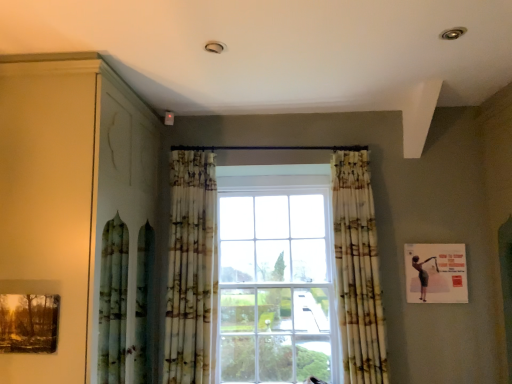
In order to face matte wood dresser at left, should I rotate leftwards or rightwards?

It's best to rotate left around 22.040 degrees.

You are a GUI agent. You are given a task and a screenshot of the screen. Output one action in this format:
    pyautogui.click(x=<x>, y=<y>)
    Task: Click on the printed fabric curtain at center, acting as the 1th curtain starting from the right
    
    Given the screenshot: What is the action you would take?
    pyautogui.click(x=357, y=270)

Identify the location of printed fabric curtain at center, which is the 1th curtain from left to right. (191, 268).

I want to click on matte wood dresser at left, so click(69, 195).

Is point (352, 339) closer to viewer compared to point (186, 186)?

Yes.

Considering the positions of objects printed fabric curtain at center, the second curtain when ordered from left to right, and printed fabric curtain at center, which is the 1th curtain from left to right, in the image provided, who is more to the left, printed fabric curtain at center, the second curtain when ordered from left to right, or printed fabric curtain at center, which is the 1th curtain from left to right,?

From the viewer's perspective, printed fabric curtain at center, which is the 1th curtain from left to right, appears more on the left side.

Is printed fabric curtain at center, the second curtain when ordered from left to right, further to camera compared to printed fabric curtain at center, the second curtain in the right-to-left sequence?

No, printed fabric curtain at center, the second curtain when ordered from left to right, is closer to the camera.

Can you confirm if matte wood dresser at left is shorter than printed fabric curtain at center, the second curtain when ordered from left to right?

No.

How different are the orientations of matte wood dresser at left and printed fabric curtain at center, acting as the 1th curtain starting from the right, in degrees?

The angle between the facing direction of matte wood dresser at left and the facing direction of printed fabric curtain at center, acting as the 1th curtain starting from the right, is 94.1 degrees.

Do you think matte wood dresser at left is within printed fabric curtain at center, the second curtain when ordered from left to right, or outside of it?

matte wood dresser at left is outside printed fabric curtain at center, the second curtain when ordered from left to right.

Considering the positions of point (54, 92) and point (375, 231), is point (54, 92) closer or farther from the camera than point (375, 231)?

Clearly, point (54, 92) is closer to the camera than point (375, 231).

Are matte wood dresser at left and matte wooden picture frame at lower left, placed as the 2th picture frame when sorted from back to front, located far from each other?

No, matte wood dresser at left is not far from matte wooden picture frame at lower left, placed as the 2th picture frame when sorted from back to front.

Is matte wood dresser at left outside of matte wooden picture frame at lower left, the second picture frame positioned from the right?

Yes.

Can you confirm if matte wood dresser at left is thinner than matte wooden picture frame at lower left, the 1th picture frame viewed from the left?

No, matte wood dresser at left is not thinner than matte wooden picture frame at lower left, the 1th picture frame viewed from the left.

How different are the orientations of matte wooden picture frame at lower left, the second picture frame positioned from the right, and printed fabric curtain at center, which is the 1th curtain from left to right, in degrees?

There is a 0.529-degree angle between the facing directions of matte wooden picture frame at lower left, the second picture frame positioned from the right, and printed fabric curtain at center, which is the 1th curtain from left to right.

Based on their sizes in the image, would you say matte wooden picture frame at lower left, which is the 1th picture frame from front to back, is bigger or smaller than printed fabric curtain at center, which is the 1th curtain from left to right?

matte wooden picture frame at lower left, which is the 1th picture frame from front to back, is smaller than printed fabric curtain at center, which is the 1th curtain from left to right.

Is matte wooden picture frame at lower left, which is the 1th picture frame from front to back, located outside printed fabric curtain at center, the second curtain in the right-to-left sequence?

matte wooden picture frame at lower left, which is the 1th picture frame from front to back, lies outside printed fabric curtain at center, the second curtain in the right-to-left sequence,'s area.

From the image's perspective, would you say matte wooden picture frame at lower left, the 1th picture frame viewed from the left, is shown under printed fabric curtain at center, the second curtain in the right-to-left sequence?

Yes.

Can we say printed fabric curtain at center, the second curtain in the right-to-left sequence, lies outside matte black picture frame at upper right, the second picture frame viewed from the left?

Absolutely, printed fabric curtain at center, the second curtain in the right-to-left sequence, is external to matte black picture frame at upper right, the second picture frame viewed from the left.

Can you tell me how much printed fabric curtain at center, which is the 1th curtain from left to right, and matte black picture frame at upper right, which is the 1th picture frame from right to left, differ in facing direction?

They differ by 0.932 degrees in their facing directions.

Relative to matte black picture frame at upper right, which is the 1th picture frame from right to left, is printed fabric curtain at center, which is the 1th curtain from left to right, in front or behind?

In the image, printed fabric curtain at center, which is the 1th curtain from left to right, appears in front of matte black picture frame at upper right, which is the 1th picture frame from right to left.

From the image's perspective, does printed fabric curtain at center, the second curtain in the right-to-left sequence, appear higher than matte black picture frame at upper right, marked as the 1th picture frame in a back-to-front arrangement?

Indeed, from the image's perspective, printed fabric curtain at center, the second curtain in the right-to-left sequence, is shown above matte black picture frame at upper right, marked as the 1th picture frame in a back-to-front arrangement.

Is matte black picture frame at upper right, which is the 1th picture frame from right to left, positioned in front of printed fabric curtain at center, the second curtain when ordered from left to right?

No, matte black picture frame at upper right, which is the 1th picture frame from right to left, is further to the viewer.

From the image's perspective, is matte black picture frame at upper right, the second picture frame viewed from the left, below printed fabric curtain at center, acting as the 1th curtain starting from the right?

Yes, from the image's perspective, matte black picture frame at upper right, the second picture frame viewed from the left, is below printed fabric curtain at center, acting as the 1th curtain starting from the right.

Considering the sizes of objects matte black picture frame at upper right, which is the 1th picture frame from right to left, and printed fabric curtain at center, acting as the 1th curtain starting from the right, in the image provided, who is thinner, matte black picture frame at upper right, which is the 1th picture frame from right to left, or printed fabric curtain at center, acting as the 1th curtain starting from the right,?

With smaller width is matte black picture frame at upper right, which is the 1th picture frame from right to left.

Does matte black picture frame at upper right, the second picture frame viewed from the left, have a smaller size compared to printed fabric curtain at center, acting as the 1th curtain starting from the right?

Indeed, matte black picture frame at upper right, the second picture frame viewed from the left, has a smaller size compared to printed fabric curtain at center, acting as the 1th curtain starting from the right.

In the image, is matte wood dresser at left on the left side or the right side of matte black picture frame at upper right, which is the 1th picture frame from right to left?

From the image, it's evident that matte wood dresser at left is to the left of matte black picture frame at upper right, which is the 1th picture frame from right to left.

Is point (77, 265) closer to viewer compared to point (446, 276)?

Yes, it is.

Which of these two, matte wood dresser at left or matte black picture frame at upper right, the second picture frame viewed from the left, stands shorter?

matte black picture frame at upper right, the second picture frame viewed from the left, is shorter.

The width and height of the screenshot is (512, 384). I want to click on dresser that is on the left side of matte black picture frame at upper right, placed as the 2th picture frame when sorted from front to back, so click(69, 195).

Where is `curtain above the printed fabric curtain at center, the second curtain when ordered from left to right (from the image's perspective)`? curtain above the printed fabric curtain at center, the second curtain when ordered from left to right (from the image's perspective) is located at coordinates (191, 268).

Identify the location of the 2nd curtain below the matte wood dresser at left (from the image's perspective). (357, 270).

Considering their positions, is matte black picture frame at upper right, the second picture frame viewed from the left, positioned closer to printed fabric curtain at center, which is the 1th curtain from left to right, than matte wooden picture frame at lower left, which is the 1th picture frame from front to back?

Among the two, matte wooden picture frame at lower left, which is the 1th picture frame from front to back, is located nearer to printed fabric curtain at center, which is the 1th curtain from left to right.

Considering their positions, is matte black picture frame at upper right, marked as the 1th picture frame in a back-to-front arrangement, positioned further to matte wood dresser at left than printed fabric curtain at center, which is the 1th curtain from left to right?

matte black picture frame at upper right, marked as the 1th picture frame in a back-to-front arrangement, is further to matte wood dresser at left.

Which object lies nearer to the anchor point matte wood dresser at left, matte black picture frame at upper right, marked as the 1th picture frame in a back-to-front arrangement, or printed fabric curtain at center, the second curtain when ordered from left to right?

Among the two, printed fabric curtain at center, the second curtain when ordered from left to right, is located nearer to matte wood dresser at left.

Which object lies nearer to the anchor point matte black picture frame at upper right, placed as the 2th picture frame when sorted from front to back, matte wooden picture frame at lower left, the second picture frame positioned from the right, or matte wood dresser at left?

matte wood dresser at left is closer to matte black picture frame at upper right, placed as the 2th picture frame when sorted from front to back.

Looking at the image, which one is located further to matte wood dresser at left, printed fabric curtain at center, the second curtain in the right-to-left sequence, or matte black picture frame at upper right, marked as the 1th picture frame in a back-to-front arrangement?

matte black picture frame at upper right, marked as the 1th picture frame in a back-to-front arrangement.

Looking at the image, which one is located further to matte black picture frame at upper right, marked as the 1th picture frame in a back-to-front arrangement, matte wood dresser at left or printed fabric curtain at center, which is the 1th curtain from left to right?

matte wood dresser at left is further to matte black picture frame at upper right, marked as the 1th picture frame in a back-to-front arrangement.

From the image, which object appears to be nearer to matte wood dresser at left, matte wooden picture frame at lower left, the second picture frame positioned from the right, or printed fabric curtain at center, acting as the 1th curtain starting from the right?

matte wooden picture frame at lower left, the second picture frame positioned from the right.

From the image, which object appears to be farther from printed fabric curtain at center, acting as the 1th curtain starting from the right, printed fabric curtain at center, the second curtain in the right-to-left sequence, or matte wood dresser at left?

The object further to printed fabric curtain at center, acting as the 1th curtain starting from the right, is matte wood dresser at left.

Identify the location of dresser situated between matte wooden picture frame at lower left, the second picture frame positioned from the right, and matte black picture frame at upper right, placed as the 2th picture frame when sorted from front to back, from left to right. The height and width of the screenshot is (384, 512). (69, 195).

Find the location of a particular element. This screenshot has height=384, width=512. curtain between matte wooden picture frame at lower left, placed as the 2th picture frame when sorted from back to front, and printed fabric curtain at center, the second curtain when ordered from left to right, in the horizontal direction is located at coordinates click(x=191, y=268).

This screenshot has width=512, height=384. Identify the location of curtain situated between printed fabric curtain at center, the second curtain in the right-to-left sequence, and matte black picture frame at upper right, the second picture frame viewed from the left, from left to right. (357, 270).

I want to click on dresser between matte wooden picture frame at lower left, placed as the 2th picture frame when sorted from back to front, and printed fabric curtain at center, acting as the 1th curtain starting from the right, in the horizontal direction, so click(69, 195).